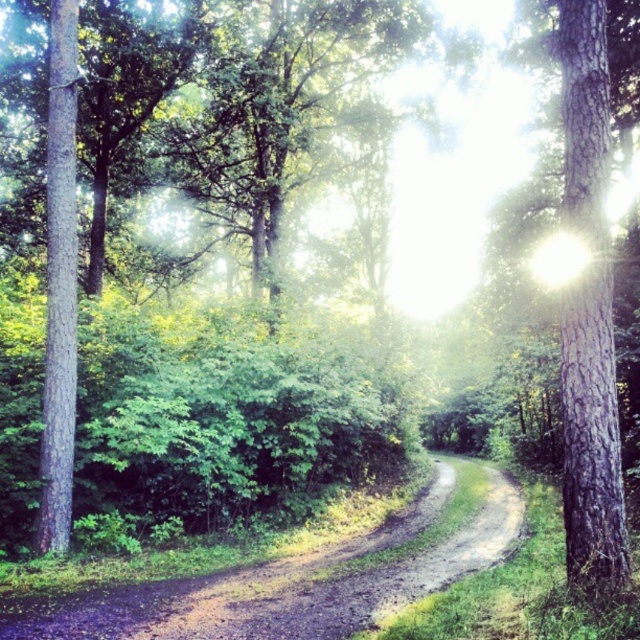
Consider the image. You are a hiker walking along the dusty brown dirt track at center and want to reach the smooth bark tree at right. Can you directly walk to it along the path?

The smooth bark tree at right is behind the dusty brown dirt track at center, so yes, you can directly walk to it along the path.

You are a hiker walking along the dusty brown dirt track at center and the smooth bark tree at right. Which object is directly above the other?

The smooth bark tree at right is directly above the dusty brown dirt track at center because the track is positioned under the tree.

You are a hiker who wants to know if you can easily step over the dusty brown dirt track at center and the smooth bark tree at right. Based on their heights, which one would be easier to step over?

The dusty brown dirt track at center has a lesser height compared to smooth bark tree at right, so it would be easier to step over the dusty brown dirt track at center since it is shorter in height.